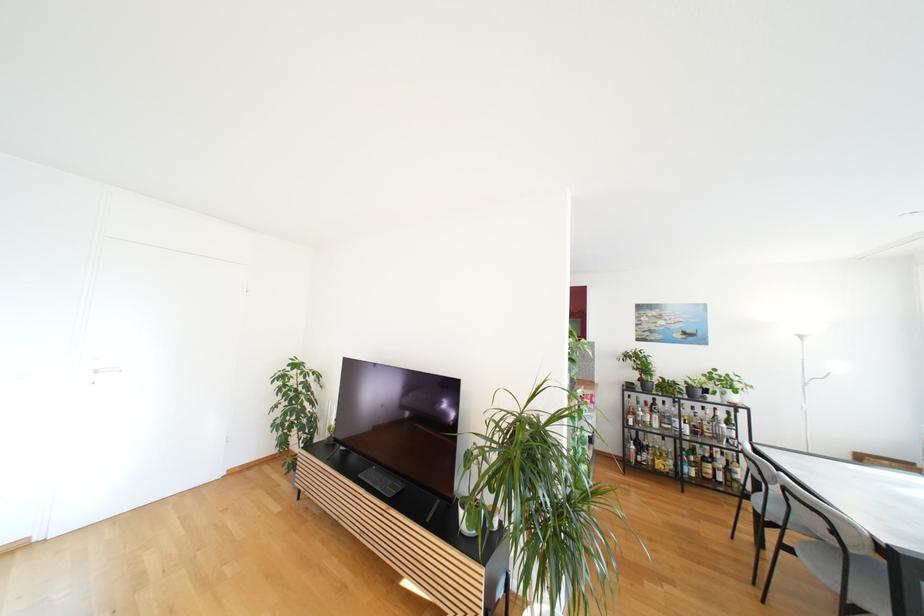
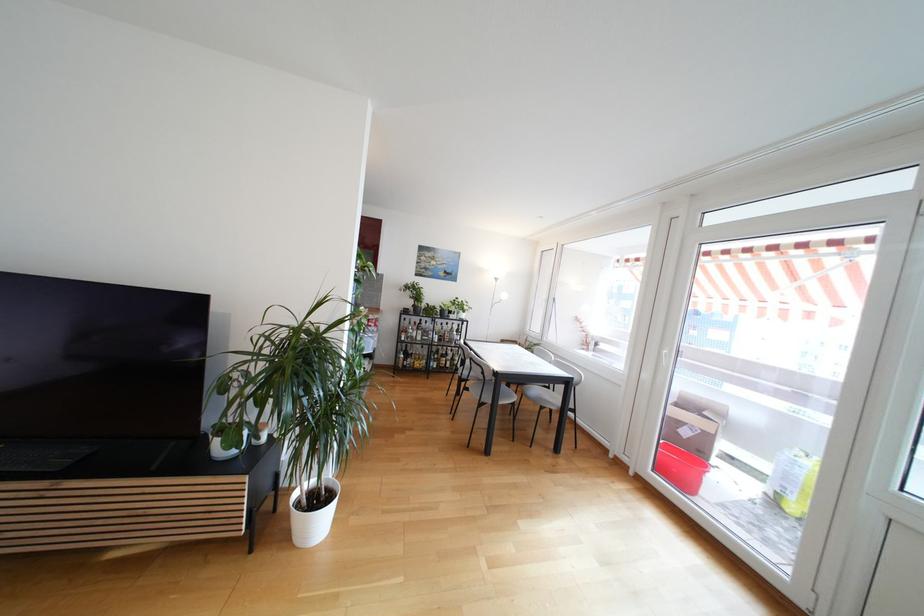
In the second image, find the point that corresponds to point (627, 392) in the first image.

(405, 315)